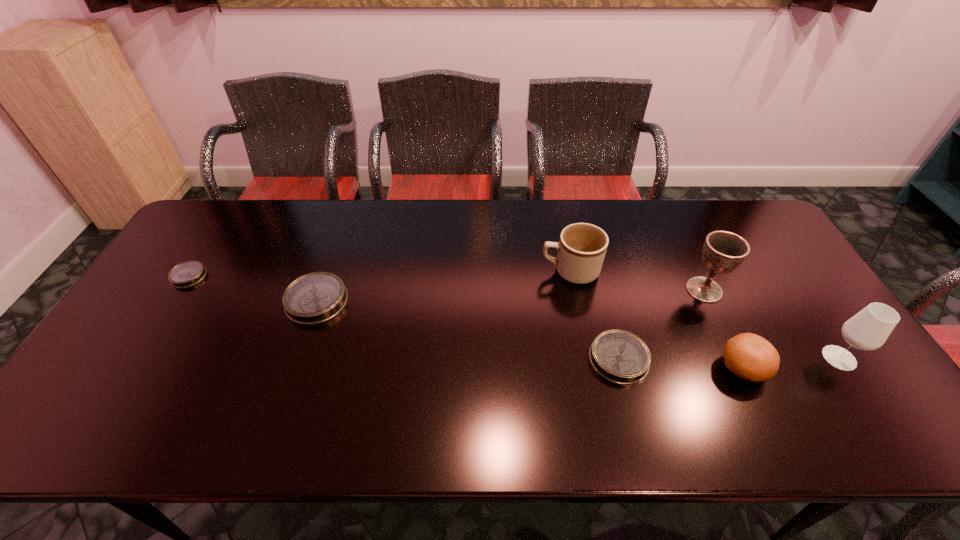
Identify the location of the shortest compass. (186, 274).

In order to click on the shortest object in this screenshot , I will do `click(186, 274)`.

This screenshot has height=540, width=960. I want to click on the sixth object from right to left, so click(314, 298).

This screenshot has height=540, width=960. I want to click on the nearest compass, so click(x=619, y=356).

Image resolution: width=960 pixels, height=540 pixels. Identify the location of the second shortest compass. (619, 356).

Locate an element on the screen. Image resolution: width=960 pixels, height=540 pixels. chalice is located at coordinates (723, 251).

Where is `glass`? glass is located at coordinates (869, 329).

The height and width of the screenshot is (540, 960). Find the location of `mug`. mug is located at coordinates (581, 249).

The height and width of the screenshot is (540, 960). I want to click on the fourth shortest object, so click(749, 356).

Where is `vacant space located on the front of the leftmost compass`? This screenshot has width=960, height=540. vacant space located on the front of the leftmost compass is located at coordinates (171, 304).